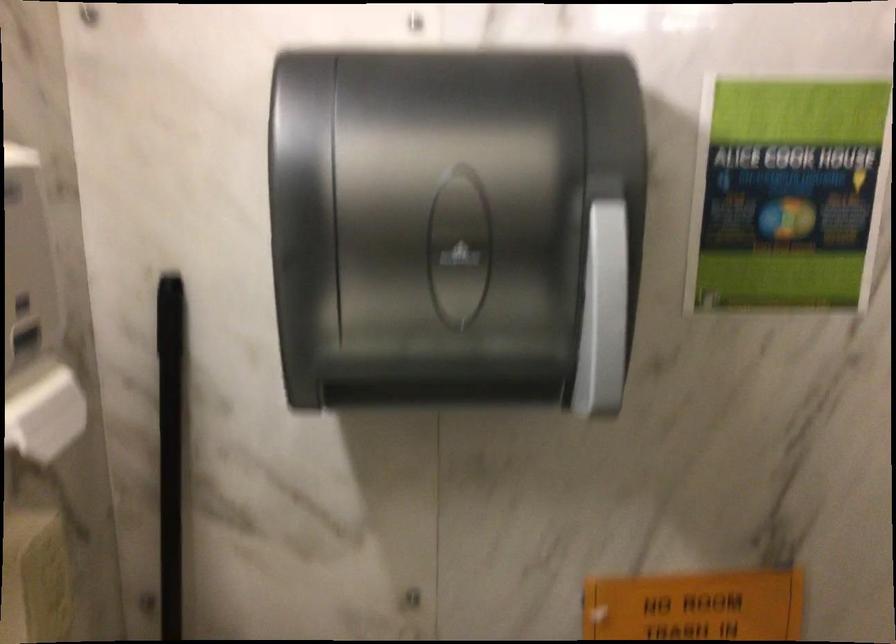
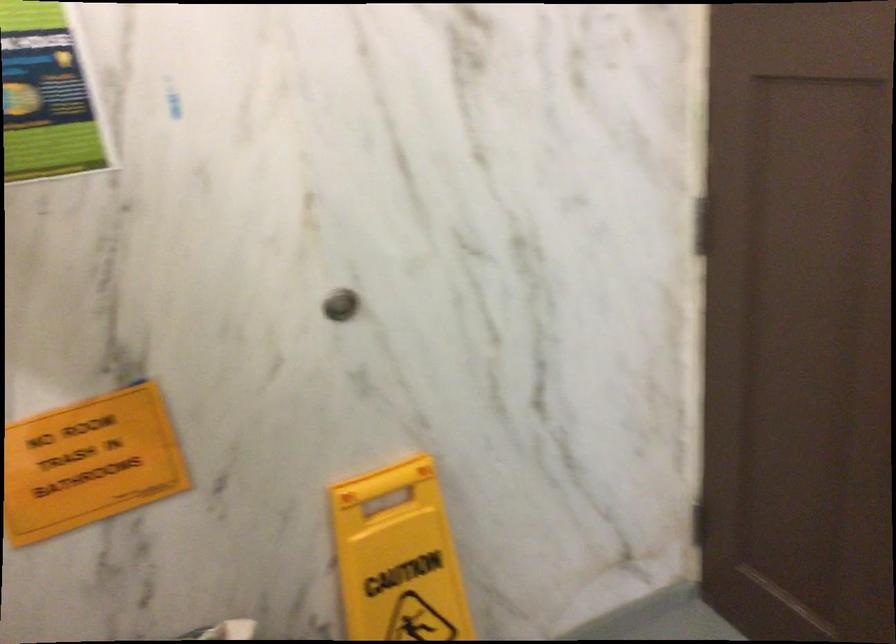
Which direction would the cameraman need to move to produce the second image?

The cameraman moved toward right, backward.